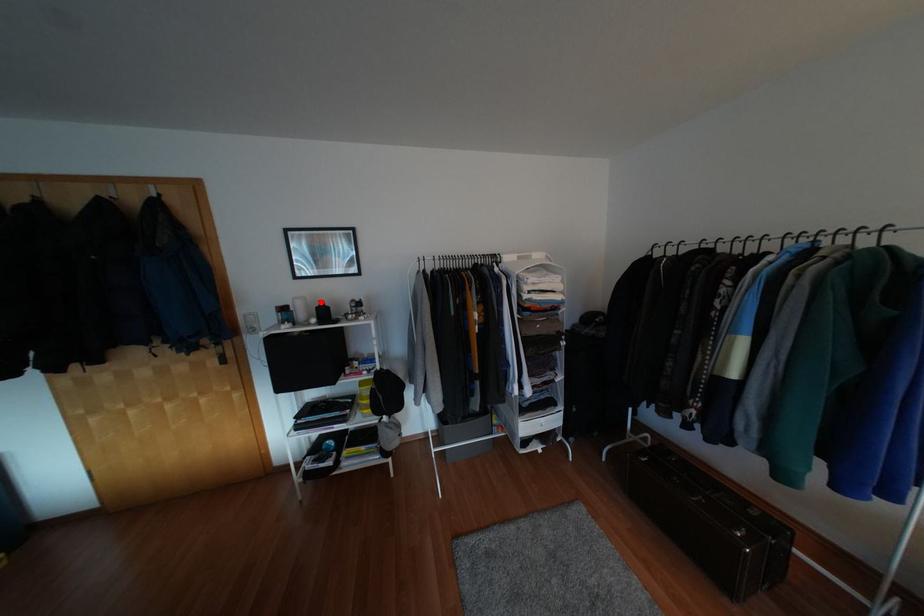
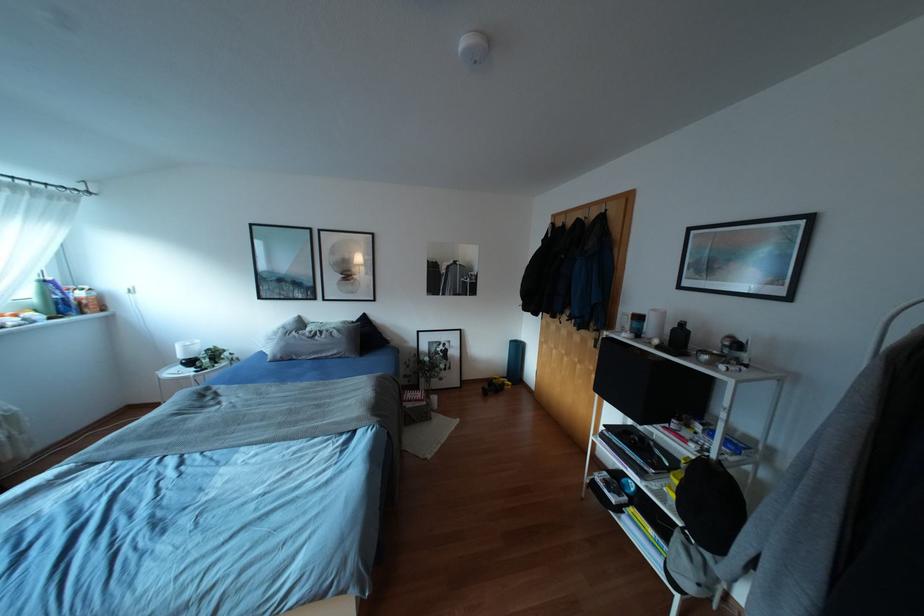
Where in the second image is the point corresponding to the highlighted location from the first image?

(682, 323)